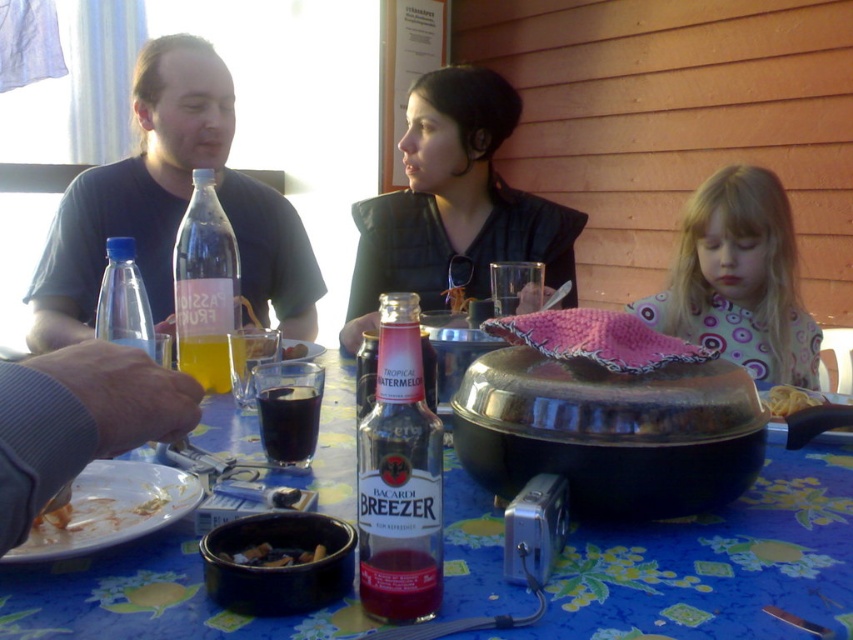
Question: Which of the following is the farthest from the observer?

Choices:
 (A) (483, 84)
 (B) (38, 490)
 (C) (112, 256)
 (D) (434, 582)

Answer: (A)

Question: Is blue fabric tablecloth at center positioned behind gray fabric hand at lower left?

Choices:
 (A) yes
 (B) no

Answer: (A)

Question: Which of the following is the closest to the observer?

Choices:
 (A) (306, 458)
 (B) (689, 268)
 (C) (473, 520)
 (D) (221, 365)

Answer: (C)

Question: Which of these objects is positioned closest to the smooth pasta at center?

Choices:
 (A) white glossy plate at lower left
 (B) matte black shirt at left
 (C) transparent plastic bottle at left

Answer: (A)

Question: Is matte black shirt at left smaller than black matte jacket at center?

Choices:
 (A) no
 (B) yes

Answer: (A)

Question: Does clear plastic bottle at center appear under charcoal ash at center?

Choices:
 (A) no
 (B) yes

Answer: (A)